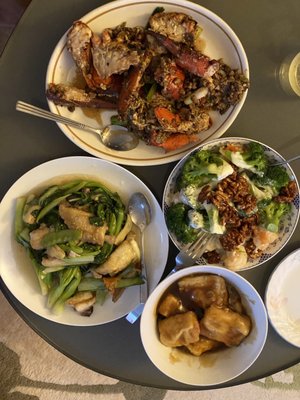
At what (x,y) coordinates should I click in order to perform the action: click on spoon handle. Please return your answer as a coordinate pair (x, y). The image size is (300, 400). Looking at the image, I should click on click(144, 269).